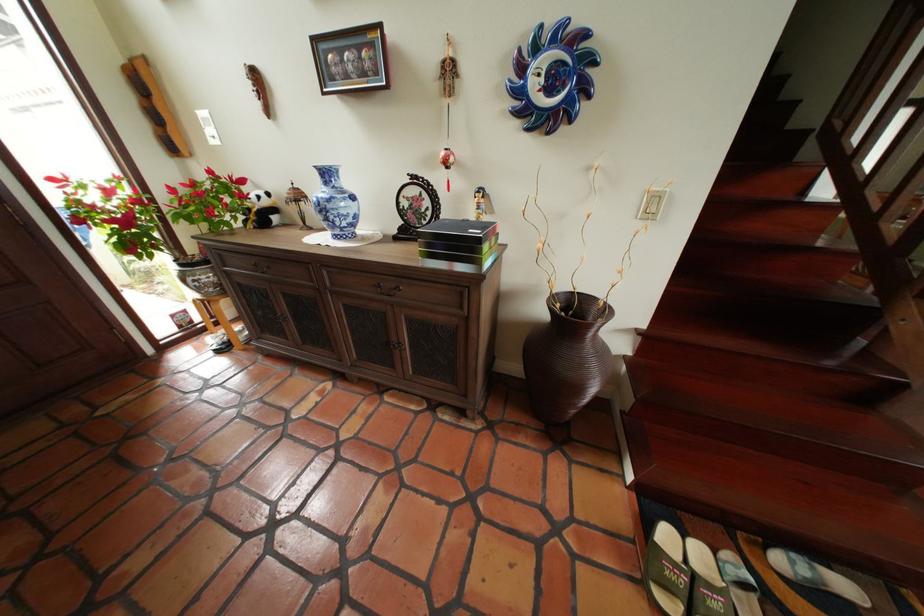
At what (x,y) coordinates should I click in order to perform the action: click on light switch. Please return your answer as a coordinate pair (x, y). The height and width of the screenshot is (616, 924). Looking at the image, I should click on pos(651,204).